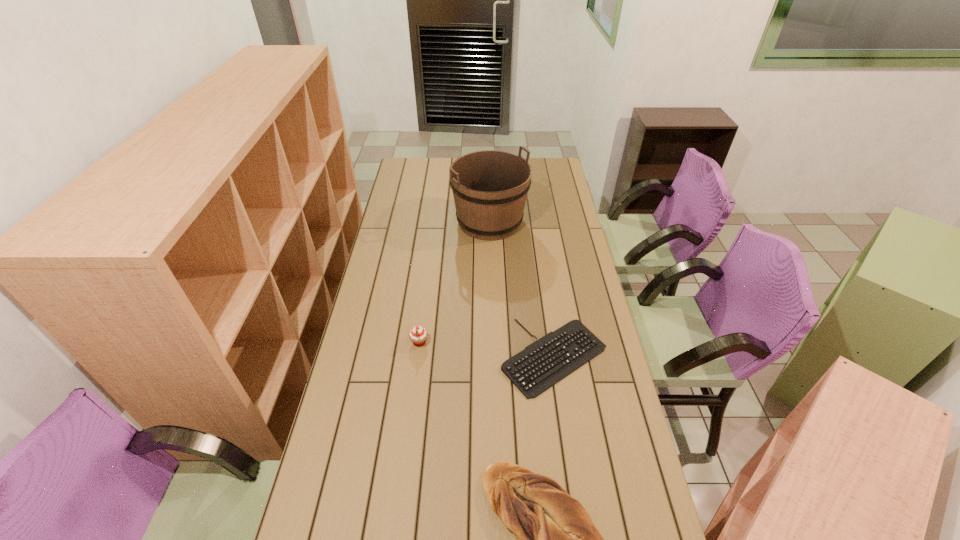
Locate an element on the screen. The width and height of the screenshot is (960, 540). vacant space at the right edge is located at coordinates (581, 301).

Find the location of a particular element. The height and width of the screenshot is (540, 960). vacant space at the far left corner of the desktop is located at coordinates (407, 178).

Where is `vacant space that is in between the computer keyboard and the bucket`? Image resolution: width=960 pixels, height=540 pixels. vacant space that is in between the computer keyboard and the bucket is located at coordinates (522, 289).

You are a GUI agent. You are given a task and a screenshot of the screen. Output one action in this format:
    pyautogui.click(x=<x>, y=<y>)
    Task: Click on the free space between the third shortest object and the bucket
    
    Given the screenshot: What is the action you would take?
    pyautogui.click(x=454, y=282)

Find the location of a particular element. The image size is (960, 540). unoccupied position between the bucket and the computer keyboard is located at coordinates (522, 289).

Find the location of a particular element. vacant area between the third shortest object and the shortest object is located at coordinates (487, 349).

Where is `object that is the third closest to the tallest object`? The height and width of the screenshot is (540, 960). object that is the third closest to the tallest object is located at coordinates (556, 539).

Locate an element on the screen. the closest object to the farthest object is located at coordinates (548, 360).